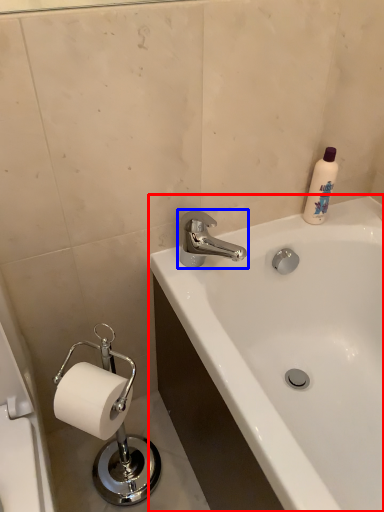
Question: Which of the following is the closest to the observer, bathtub (highlighted by a red box) or tap (highlighted by a blue box)?

Choices:
 (A) bathtub
 (B) tap

Answer: (A)